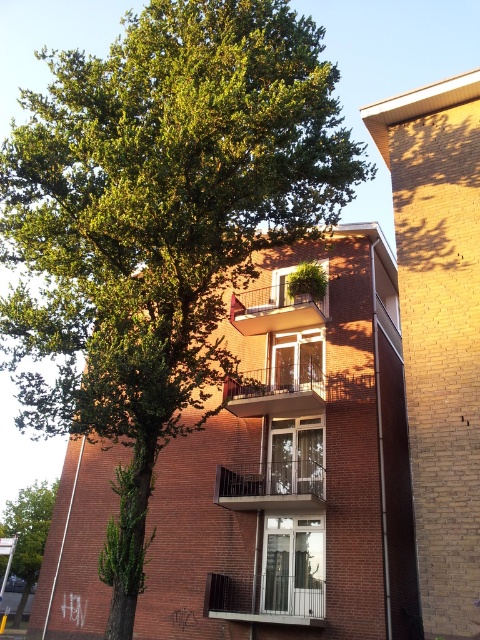
Question: Can you confirm if green leafy tree at lower left is smaller than metallic balcony at center?

Choices:
 (A) yes
 (B) no

Answer: (B)

Question: Which object is the closest to the clear glass balcony at center?

Choices:
 (A) black metal balcony at center
 (B) white metal balcony at lower center
 (C) green leafy tree at lower left

Answer: (A)

Question: Which object is the closest to the white metal balcony at lower center?

Choices:
 (A) black metal balcony at center
 (B) green leafy tree at lower left
 (C) clear glass balcony at center
 (D) metallic balcony at center

Answer: (A)

Question: Does white metal balcony at lower center have a greater width compared to metallic balcony at center?

Choices:
 (A) no
 (B) yes

Answer: (A)

Question: Among these points, which one is nearest to the camera?

Choices:
 (A) (303, 493)
 (B) (47, 508)

Answer: (A)

Question: Is clear glass balcony at center thinner than green leafy tree at lower left?

Choices:
 (A) yes
 (B) no

Answer: (A)